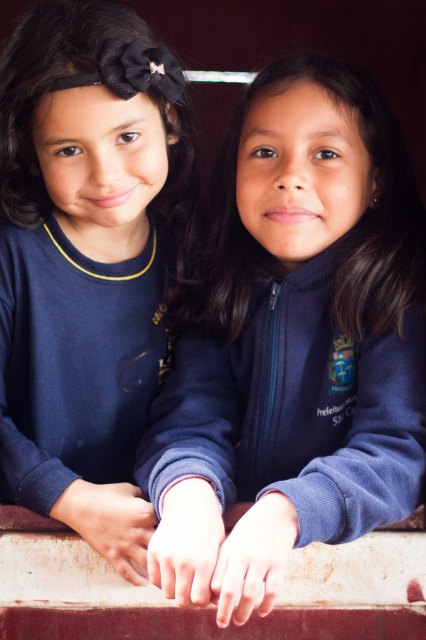
You are a photographer trying to capture both the matte blue sweatshirt at center and the navy blue sweatshirt at left in a single shot. Which sweatshirt should you focus on first to ensure both are in the frame?

You should focus on the navy blue sweatshirt at left first because the matte blue sweatshirt at center is in front of it, so starting with the one further back will help ensure both are included in the frame.

What are the coordinates of the matte blue sweatshirt at center?

The coordinates of the matte blue sweatshirt at center are (294, 342).